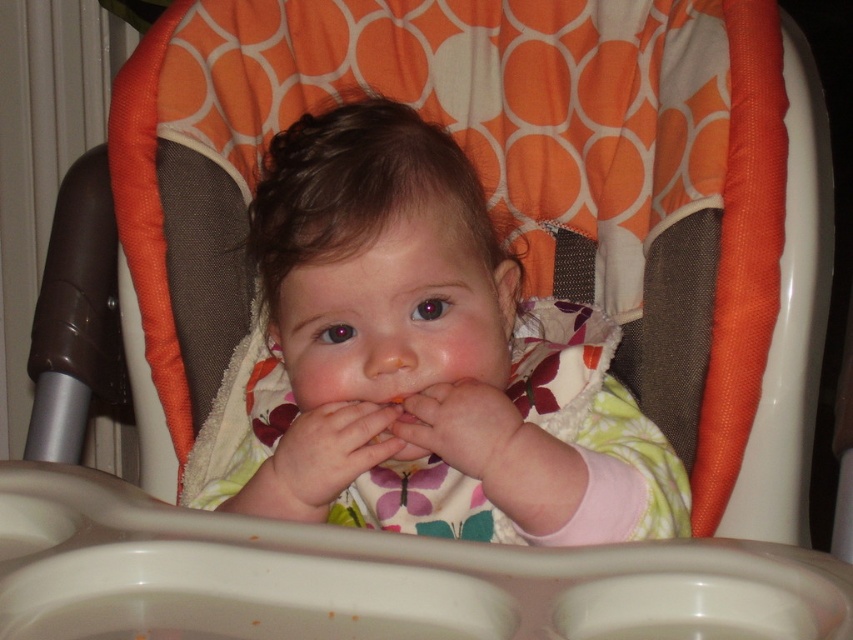
Can you confirm if smooth skin hand at center is positioned to the left of pale skin at center?

Yes, smooth skin hand at center is to the left of pale skin at center.

Measure the distance between smooth skin hand at center and camera.

The distance of smooth skin hand at center from camera is 69.21 centimeters.

Identify the location of smooth skin hand at center. The image size is (853, 640). (325, 456).

Does floral fabric baby at center have a greater height compared to pale skin at center?

Yes, floral fabric baby at center is taller than pale skin at center.

Between floral fabric baby at center and pale skin at center, which one appears on the left side from the viewer's perspective?

From the viewer's perspective, floral fabric baby at center appears more on the left side.

You are a GUI agent. You are given a task and a screenshot of the screen. Output one action in this format:
    pyautogui.click(x=<x>, y=<y>)
    Task: Click on the floral fabric baby at center
    This screenshot has width=853, height=640.
    Given the screenshot: What is the action you would take?
    pyautogui.click(x=426, y=358)

Consider the image. Between floral fabric baby at center and smooth skin hand at center, which one appears on the left side from the viewer's perspective?

From the viewer's perspective, smooth skin hand at center appears more on the left side.

Based on the photo, does floral fabric baby at center have a lesser width compared to smooth skin hand at center?

No.

Does point (370, 134) come farther from viewer compared to point (326, 413)?

Yes, point (370, 134) is farther from viewer.

This screenshot has width=853, height=640. What are the coordinates of `floral fabric baby at center` in the screenshot? It's located at (426, 358).